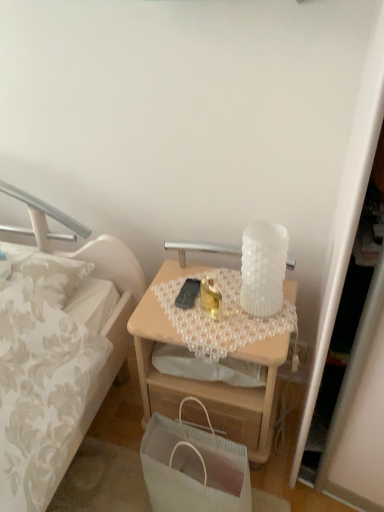
In order to click on free space between black matte mobile phone at center and white textured glass at upper center in this screenshot , I will do `click(202, 285)`.